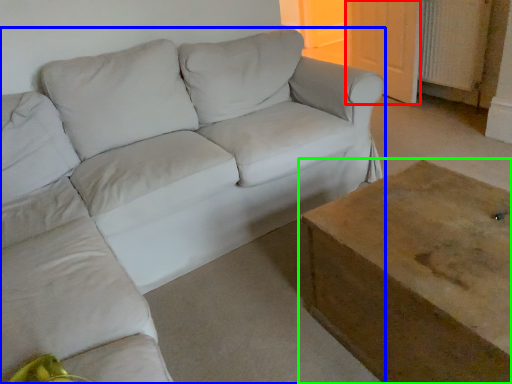
Question: Estimate the real-world distances between objects in this image. Which object is farther from door (highlighted by a red box), studio couch (highlighted by a blue box) or table (highlighted by a green box)?

Choices:
 (A) studio couch
 (B) table

Answer: (B)